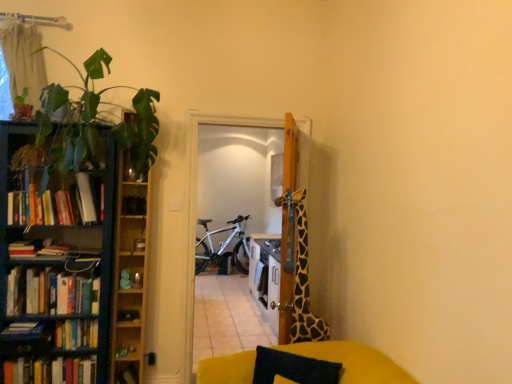
Question: From their relative heights in the image, would you say white sheer curtain at upper left is taller or shorter than black fabric pillow at lower center?

Choices:
 (A) short
 (B) tall

Answer: (B)

Question: Is point (31, 100) positioned closer to the camera than point (290, 352)?

Choices:
 (A) closer
 (B) farther

Answer: (B)

Question: Based on their relative distances, which object is nearer to the hardcover book at left, positioned as the sixth book in top-to-bottom order?

Choices:
 (A) hardcover book at left, which is counted as the 5th book, starting from the top
 (B) hardcover book at left, placed as the 3th book when sorted from top to bottom
 (C) hardcover books at left, the 4th book positioned from the top
 (D) white matte bicycle at center
 (E) green matte bookcase at left

Answer: (A)

Question: Which of these objects is positioned farthest from the green matte bookcase at left?

Choices:
 (A) hardcover books at left, arranged as the 1th book when viewed from the top
 (B) hardcover books at left, which is counted as the third book, starting from the bottom
 (C) wooden cabinet at left
 (D) hardcover book at left, the second book when ordered from bottom to top
 (E) white sheer curtain at upper left

Answer: (E)